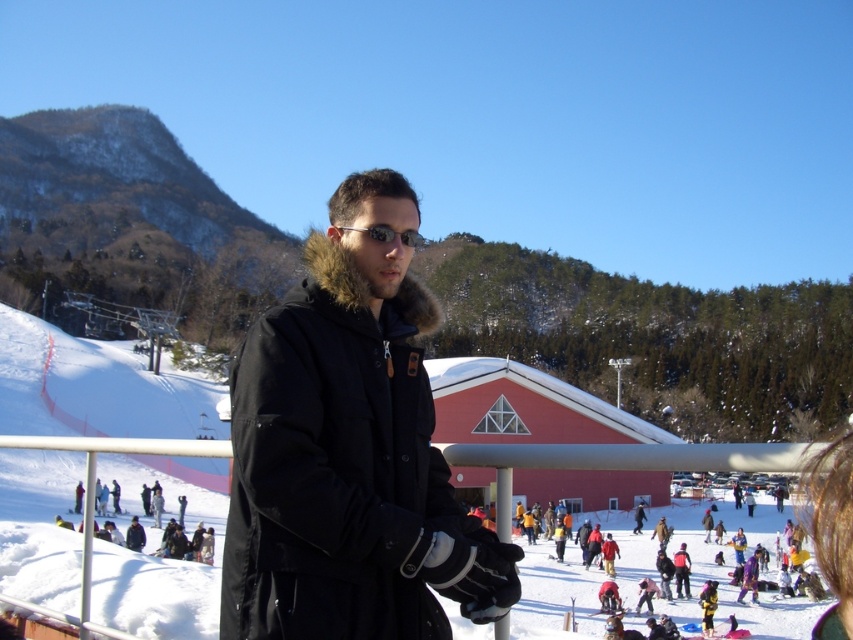
Question: Does black fur-lined coat at center appear on the right side of white fluffy snow at center?

Choices:
 (A) no
 (B) yes

Answer: (B)

Question: Among these objects, which one is nearest to the camera?

Choices:
 (A) white fluffy snow at center
 (B) black fur-lined coat at center

Answer: (B)

Question: Does black fur-lined coat at center have a lesser width compared to white fluffy snow at center?

Choices:
 (A) yes
 (B) no

Answer: (A)

Question: Among these objects, which one is nearest to the camera?

Choices:
 (A) black fur-lined coat at center
 (B) white fluffy snow at center

Answer: (A)

Question: Among these points, which one is farthest from the camera?

Choices:
 (A) (517, 592)
 (B) (152, 538)

Answer: (B)

Question: Can you confirm if black fur-lined coat at center is positioned to the left of white fluffy snow at center?

Choices:
 (A) no
 (B) yes

Answer: (A)